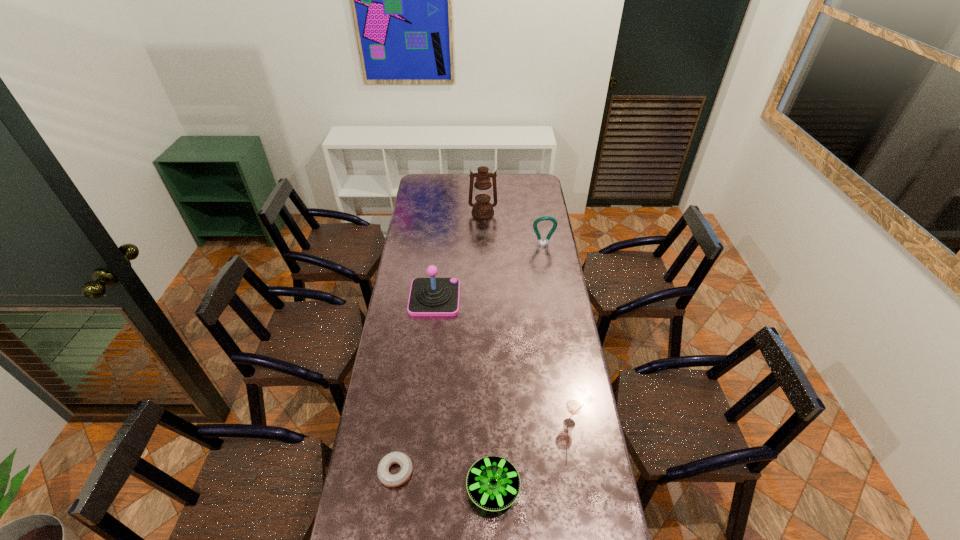
Identify the location of free space between the joystick and the fifth tallest object. The height and width of the screenshot is (540, 960). (464, 393).

Identify the location of free space between the third nearest object and the saucer. (532, 456).

Where is `empty space between the straw and the saucer`? empty space between the straw and the saucer is located at coordinates (532, 456).

You are a GUI agent. You are given a task and a screenshot of the screen. Output one action in this format:
    pyautogui.click(x=<x>, y=<y>)
    Task: Click on the vacant area that lies between the saucer and the bottle opener
    The width and height of the screenshot is (960, 540).
    Given the screenshot: What is the action you would take?
    pyautogui.click(x=518, y=367)

Where is `vacant area that lies between the third nearest object and the fifth nearest object`? vacant area that lies between the third nearest object and the fifth nearest object is located at coordinates (557, 334).

This screenshot has width=960, height=540. Identify the location of vacant space that is in between the straw and the fifth tallest object. (532, 456).

Locate an element on the screen. vacant region between the third farthest object and the tallest object is located at coordinates (459, 255).

Find the location of a particular element. The image size is (960, 540). empty location between the joystick and the tallest object is located at coordinates click(x=459, y=255).

Where is `empty space that is in between the fifth nearest object and the joystick`? The image size is (960, 540). empty space that is in between the fifth nearest object and the joystick is located at coordinates (489, 272).

Identify the location of unoccupied position between the second shortest object and the bottle opener. The image size is (960, 540). (518, 367).